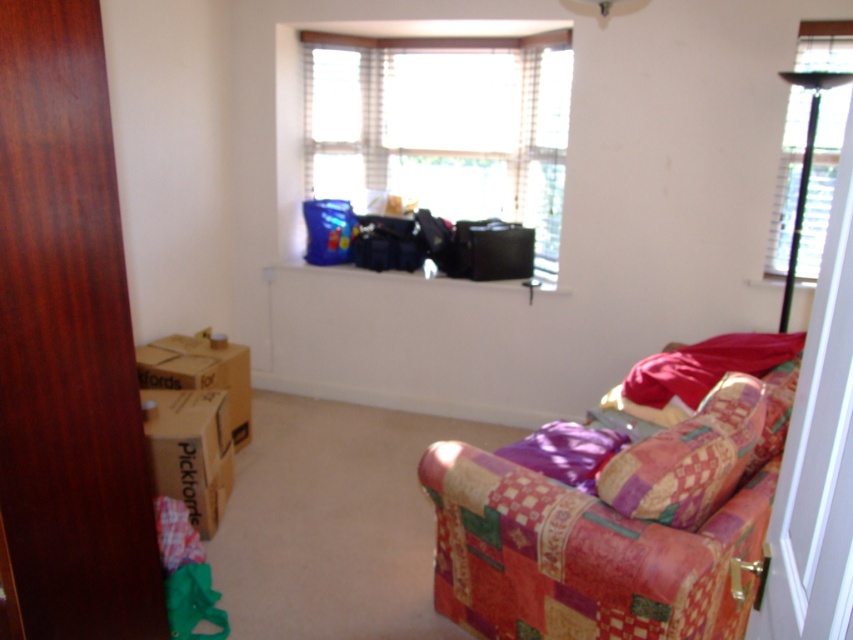
You are a delivery person who just arrived at the apartment and need to place a new camera in the room. The camera requires a space that is at least 3 meters away from any existing objects to avoid clutter. Based on the scene, is there enough space between the cardboard box at lower left and the camera to place it safely?

The distance between the cardboard box at lower left and the camera is 2.68 meters, which is less than the required 3 meters. Therefore, placing the camera there would not meet the space requirement.

You are organizing items in the room and need to place a new item between the translucent plastic bags at upper center and the cardboard box at lower left. Based on their positions, which object should you place closer to the front of the room?

The translucent plastic bags at upper center should be placed closer to the front of the room because they are further to the viewer than the cardboard box at lower left.